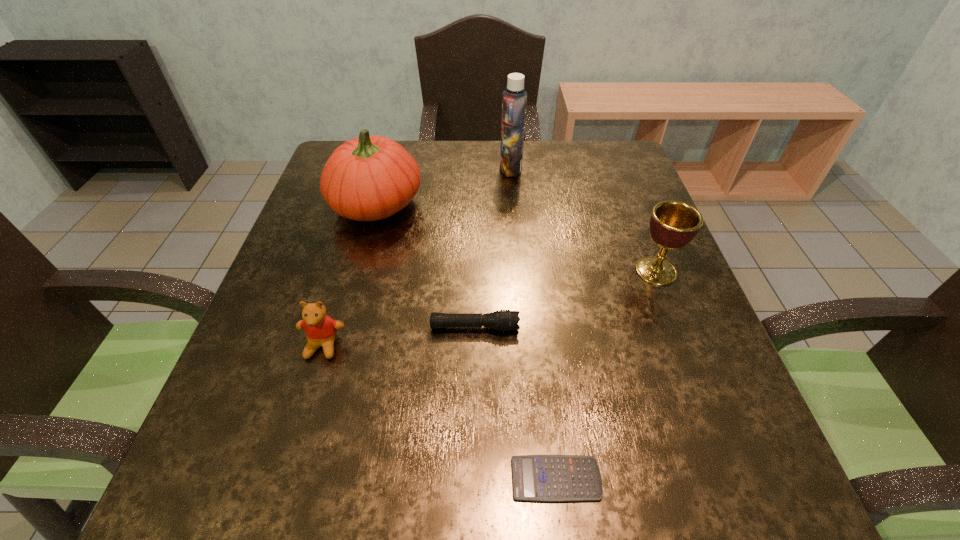
Where is `blank space located on the front label of the tallest object`? The image size is (960, 540). blank space located on the front label of the tallest object is located at coordinates (388, 168).

Identify the location of blank space located on the front of the second tallest object. (342, 334).

Image resolution: width=960 pixels, height=540 pixels. In order to click on blank space located 0.290m on the back of the third tallest object in this screenshot , I will do (621, 182).

At what (x,y) coordinates should I click in order to perform the action: click on free space located on the front-facing side of the fourth tallest object. Please return your answer as a coordinate pair (x, y). Image resolution: width=960 pixels, height=540 pixels. Looking at the image, I should click on (300, 425).

At what (x,y) coordinates should I click in order to perform the action: click on blank space located 0.240m at the lens end of the flashlight. Please return your answer as a coordinate pair (x, y). Looking at the image, I should click on (644, 327).

Locate an element on the screen. vacant space situated on the back of the calculator is located at coordinates (538, 321).

Where is `shampoo situated at the far edge`? This screenshot has height=540, width=960. shampoo situated at the far edge is located at coordinates (514, 100).

Locate an element on the screen. This screenshot has height=540, width=960. pumpkin that is at the far edge is located at coordinates (368, 178).

This screenshot has width=960, height=540. Find the location of `object at the near edge`. object at the near edge is located at coordinates (544, 478).

Identify the location of pumpkin that is at the left edge. Image resolution: width=960 pixels, height=540 pixels. (368, 178).